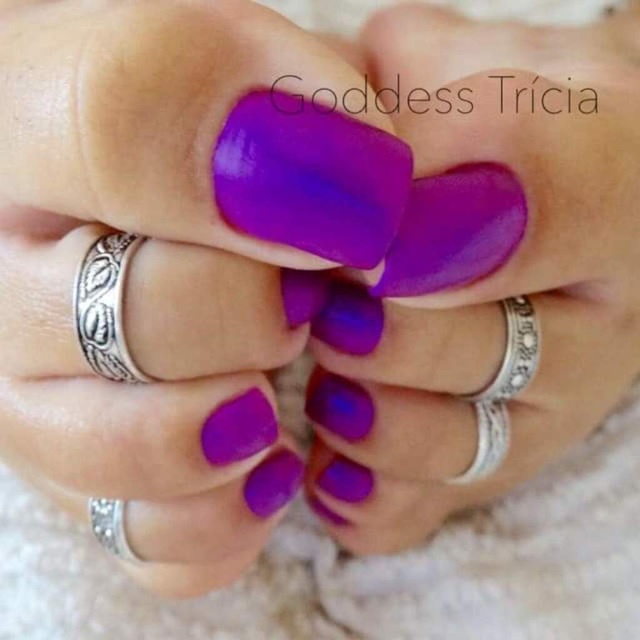
In the scene shown: Is matte purple nail polish at center further to camera compared to matte silver ring at center?

No.

Who is more forward, (337, 54) or (637, 276)?

Positioned in front is point (337, 54).

The image size is (640, 640). I want to click on matte purple nail polish at center, so click(x=150, y=269).

Is matte silver ring at center wider than silver textured band at left?

Yes.

Who is positioned more to the left, matte silver ring at center or silver textured band at left?

From the viewer's perspective, silver textured band at left appears more on the left side.

Where is `matte silver ring at center`? The image size is (640, 640). matte silver ring at center is located at coordinates (486, 276).

The image size is (640, 640). I want to click on matte silver ring at center, so click(x=486, y=276).

Does matte silver ring at center lie behind glossy purple nail polish at center?

Yes, matte silver ring at center is behind glossy purple nail polish at center.

Which is more to the left, matte silver ring at center or glossy purple nail polish at center?

Positioned to the left is glossy purple nail polish at center.

Who is more forward, (490, 276) or (269, 202)?

Positioned in front is point (269, 202).

This screenshot has width=640, height=640. I want to click on matte silver ring at center, so click(486, 276).